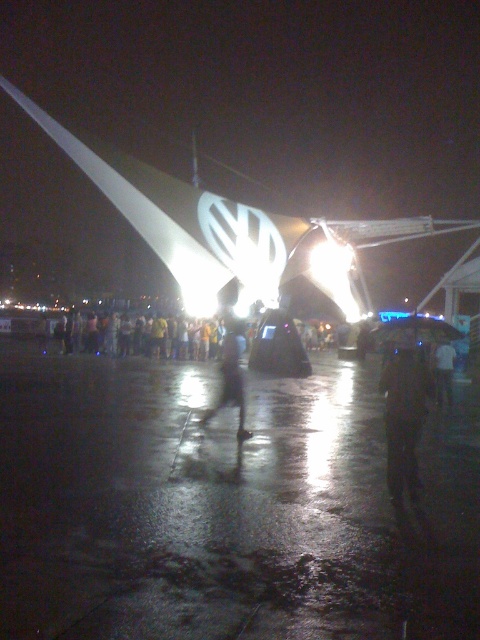
Who is higher up, yellow casual clothing at center or dark matte figure at center?

yellow casual clothing at center is above.

Identify the location of yellow casual clothing at center. The height and width of the screenshot is (640, 480). (137, 336).

Where is `yellow casual clothing at center`? This screenshot has width=480, height=640. yellow casual clothing at center is located at coordinates (137, 336).

Between black matte jacket at center and yellow casual clothing at center, which one has less height?

yellow casual clothing at center is shorter.

Is point (425, 365) farther from camera compared to point (84, 326)?

No, it is in front of (84, 326).

The width and height of the screenshot is (480, 640). I want to click on black matte jacket at center, so click(404, 413).

Can you confirm if black matte jacket at center is positioned to the right of white matte shirt at center?

No, black matte jacket at center is not to the right of white matte shirt at center.

Can you confirm if black matte jacket at center is shorter than white matte shirt at center?

No.

What do you see at coordinates (404, 413) in the screenshot? The width and height of the screenshot is (480, 640). I see `black matte jacket at center` at bounding box center [404, 413].

Find the location of a particular element. The image size is (480, 640). black matte jacket at center is located at coordinates (404, 413).